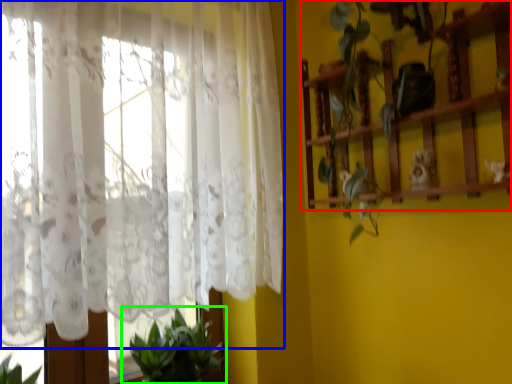
Question: Which object is the closest to the shelf (highlighted by a red box)? Choose among these: curtain (highlighted by a blue box) or houseplant (highlighted by a green box).

Choices:
 (A) curtain
 (B) houseplant

Answer: (A)